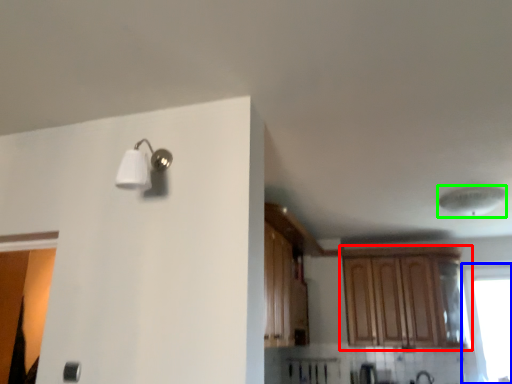
Question: Which is nearer to the cabinetry (highlighted by a red box)? window (highlighted by a blue box) or lamp (highlighted by a green box).

Choices:
 (A) window
 (B) lamp

Answer: (A)